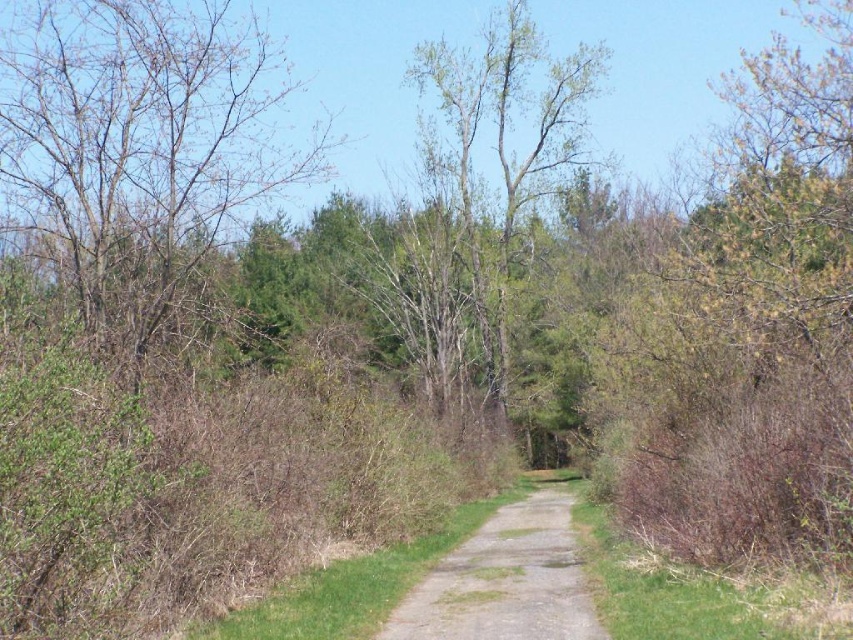
Question: Estimate the real-world distances between objects in this image. Which object is closer to the dull gray gravel path at center?

Choices:
 (A) bare branches at left
 (B) green leafy tree at center

Answer: (A)

Question: Which point is closer to the camera taking this photo?

Choices:
 (A) (221, 58)
 (B) (483, 289)
 (C) (572, 593)

Answer: (C)

Question: Is bare branches at left positioned in front of green leafy tree at center?

Choices:
 (A) no
 (B) yes

Answer: (B)

Question: Is green leafy tree at center to the right of dull gray gravel path at center from the viewer's perspective?

Choices:
 (A) no
 (B) yes

Answer: (B)

Question: Which point appears closest to the camera in this image?

Choices:
 (A) click(x=73, y=225)
 (B) click(x=595, y=84)

Answer: (A)

Question: Does bare branches at left appear under green leafy tree at center?

Choices:
 (A) no
 (B) yes

Answer: (A)